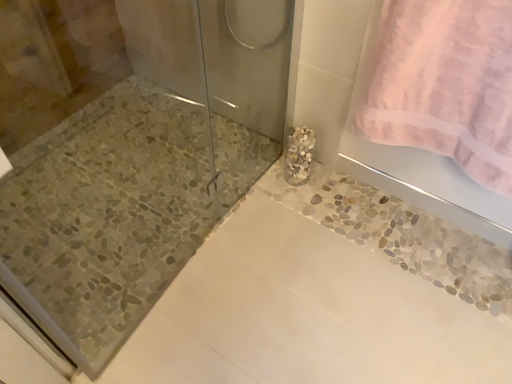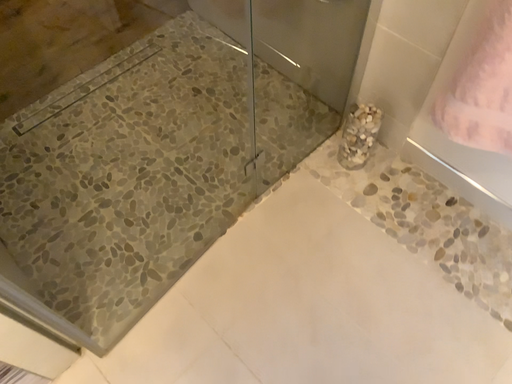
Question: How did the camera likely rotate when shooting the video?

Choices:
 (A) rotated downward
 (B) rotated upward

Answer: (A)